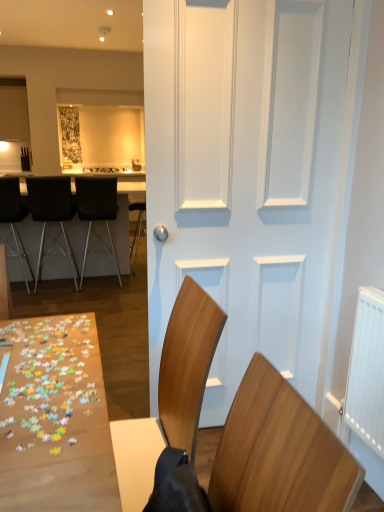
Question: Based on their positions, is black leather chair at center, acting as the second chair starting from the right, located to the left or right of black metal bar stool at left, which is the 3th chair in back-to-front order?

Choices:
 (A) right
 (B) left

Answer: (A)

Question: In the image, is black leather chair at center, which is counted as the third chair, starting from the left, positioned in front of or behind black metal bar stool at left, the 2th chair when ordered from front to back?

Choices:
 (A) behind
 (B) front

Answer: (A)

Question: Based on their relative distances, which object is nearer to the black metal bar stool at left, which is the 3th chair in back-to-front order?

Choices:
 (A) black leather table at left
 (B) white matte door at center
 (C) wooden chair at lower right, the fourth chair viewed from the back
 (D) white plastic radiator at right
 (E) black leather chair at center, which is counted as the third chair, starting from the left

Answer: (A)

Question: Which object is positioned closest to the black leather table at left?

Choices:
 (A) black leather chair at center, which is the first chair from back to front
 (B) black leather chair at left, which is the 2th chair from left to right
 (C) black metal bar stool at left, which is counted as the 1th chair, starting from the left
 (D) white plastic radiator at right
 (E) wooden chair at lower right, placed as the fourth chair when sorted from left to right

Answer: (C)